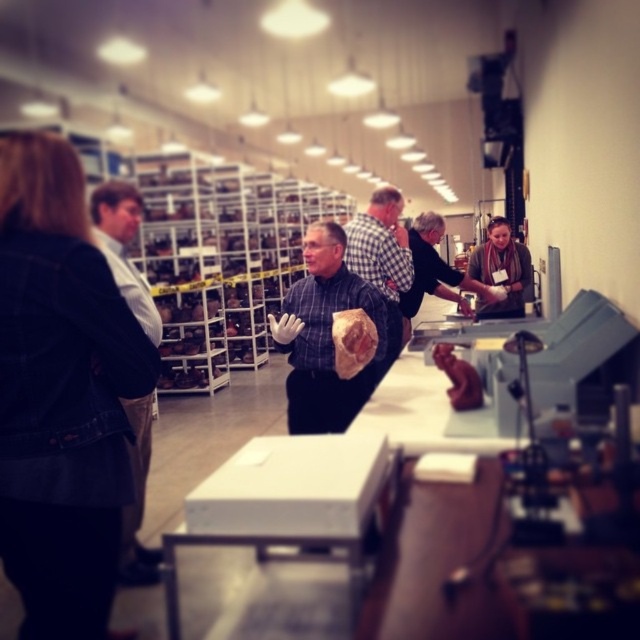
Question: Can you confirm if white shirt at left is wider than matte black shirt at center?

Choices:
 (A) yes
 (B) no

Answer: (B)

Question: Which point appears closest to the camera in this image?

Choices:
 (A) (83, 532)
 (B) (92, 227)

Answer: (A)

Question: Which of these objects is positioned farthest from the matte brown paper bag at center?

Choices:
 (A) brown wool scarf at upper right
 (B) white shirt at left
 (C) denim jacket at left

Answer: (A)

Question: Can you confirm if denim jacket at left is positioned below matte black shirt at center?

Choices:
 (A) yes
 (B) no

Answer: (A)

Question: Can you confirm if matte brown paper bag at center is positioned below matte black shirt at center?

Choices:
 (A) yes
 (B) no

Answer: (A)

Question: Which point appears closest to the camera in this image?

Choices:
 (A) [x=60, y=280]
 (B) [x=436, y=289]
 (C) [x=99, y=228]

Answer: (A)